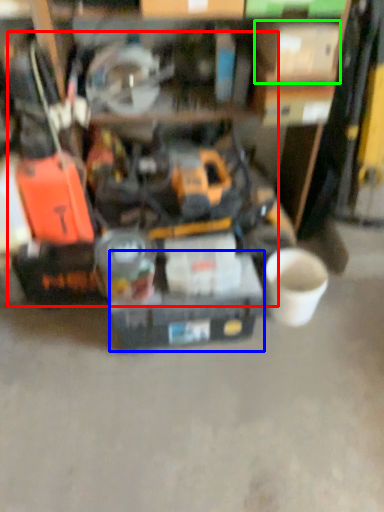
Question: Which object is positioned closest to tool (highlighted by a red box)? Select from box (highlighted by a blue box) and box (highlighted by a green box).

Choices:
 (A) box
 (B) box

Answer: (A)